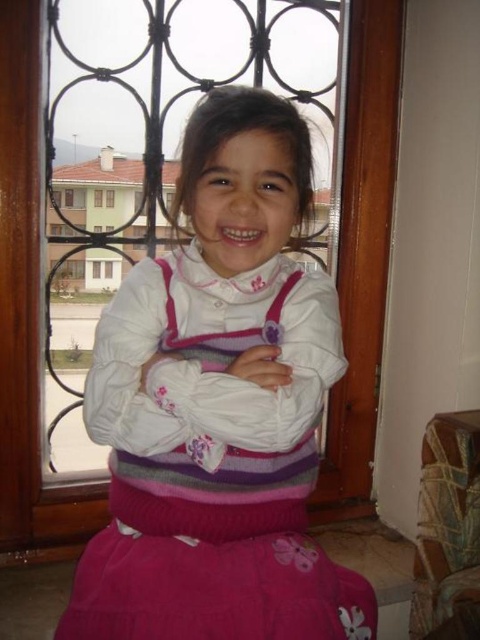
Is pink knitted sweater at center taller than white matte arm at center?

Yes, pink knitted sweater at center is taller than white matte arm at center.

Which of these two, pink knitted sweater at center or white matte arm at center, stands taller?

Standing taller between the two is pink knitted sweater at center.

Is point (231, 410) positioned after point (148, 417)?

No, it is not.

At what (x,y) coordinates should I click in order to perform the action: click on pink knitted sweater at center. Please return your answer as a coordinate pair (x, y). Looking at the image, I should click on (218, 406).